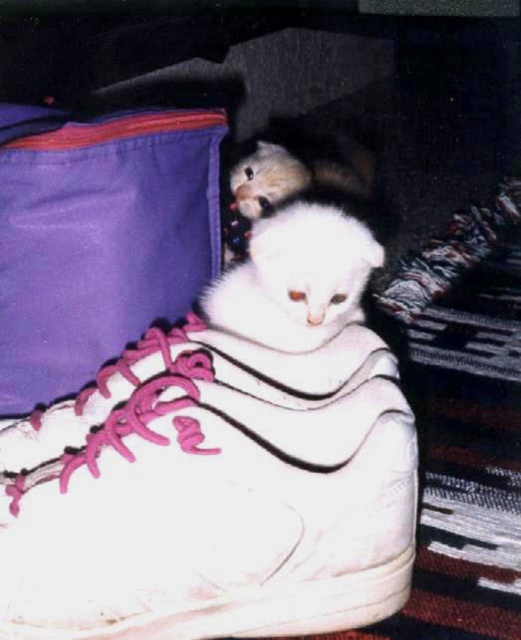
Looking at this image, you are a cat owner who wants to place a new sneaker next to your two cats. The sneaker you have is 7.35 inches wide. Based on the image, will the sneaker fit in the space between the white matte sneaker at center and the white fluffy cat at center?

The white matte sneaker at center is 7.35 inches away from the white fluffy cat at center. Since the sneaker you have is exactly 7.35 inches wide, it should fit perfectly in the space between them.

Looking at this image, you are a photographer trying to capture the two kittens inside the white matte sneaker at center. Since the white fluffy cat at center is partially hidden, you want to adjust the angle to make sure both are fully visible. Given the height difference between the two, which object should you lift slightly to achieve this?

The white fluffy cat at center is shorter than the white matte sneaker at center. To ensure both kittens are fully visible, you should lift the white fluffy cat at center slightly so it stands taller, allowing its view to be unobstructed by the sneaker.

Looking at this image, you are a photographer trying to capture the white fluffy cat at center in the image. The white matte sneaker at center is blocking part of the cat. Can you move the sneaker to get a clearer shot of the cat?

The white matte sneaker at center is positioned under the white fluffy cat at center, so moving the sneaker would allow you to get a clearer shot of the cat.